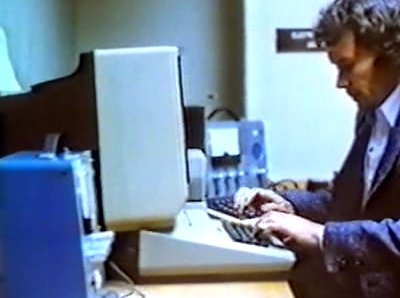
This screenshot has width=400, height=298. Find the location of `old computer`. old computer is located at coordinates (128, 147).